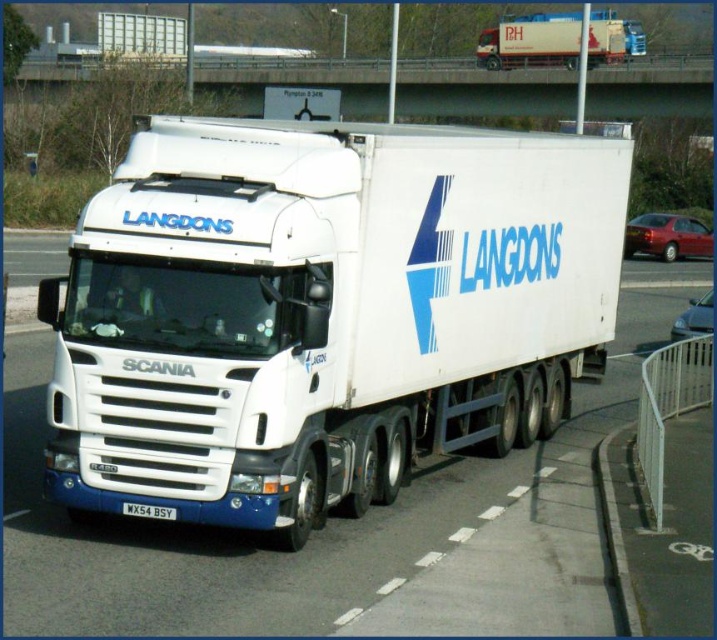
Question: Does white matte trailer truck at center appear under white matte truck at upper center?

Choices:
 (A) no
 (B) yes

Answer: (B)

Question: Does white matte trailer truck at center appear on the right side of black plastic license plate at center?

Choices:
 (A) yes
 (B) no

Answer: (A)

Question: Which object is the closest to the white matte trailer truck at center?

Choices:
 (A) black plastic license plate at center
 (B) brushed metal bridge at upper center
 (C) white matte truck at upper center

Answer: (A)

Question: Which object is positioned closest to the brushed metal bridge at upper center?

Choices:
 (A) white matte truck at upper center
 (B) white matte trailer truck at center
 (C) black plastic license plate at center

Answer: (A)

Question: Does white matte trailer truck at center have a lesser width compared to brushed metal bridge at upper center?

Choices:
 (A) yes
 (B) no

Answer: (A)

Question: Which of the following is the closest to the observer?

Choices:
 (A) (551, 72)
 (B) (146, 372)

Answer: (B)